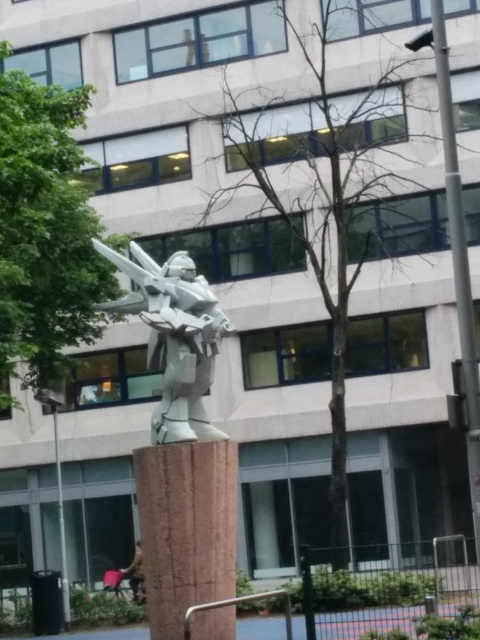
Can you confirm if bare branches at center is taller than brown stone post at center?

No.

Between bare branches at center and brown stone post at center, which one appears on the left side from the viewer's perspective?

brown stone post at center

Who is more forward, (x=301, y=154) or (x=206, y=451)?

Point (x=206, y=451) is more forward.

You are a GUI agent. You are given a task and a screenshot of the screen. Output one action in this format:
    pyautogui.click(x=<x>, y=<y>)
    Task: Click on the bare branches at center
    
    Given the screenshot: What is the action you would take?
    pyautogui.click(x=323, y=200)

What do you see at coordinates (175, 337) in the screenshot? Image resolution: width=480 pixels, height=640 pixels. I see `white glossy statue at center` at bounding box center [175, 337].

Where is `white glossy statue at center`? This screenshot has height=640, width=480. white glossy statue at center is located at coordinates (175, 337).

Identify the location of white glossy statue at center. The width and height of the screenshot is (480, 640). (175, 337).

Who is more distant from viewer, [68,620] or [134,584]?

The point [134,584] is more distant.

Describe the element at coordinates (60, 522) in the screenshot. The width and height of the screenshot is (480, 640). I see `metallic pole at center` at that location.

Who is more distant from viewer, (59, 513) or (137, 598)?

Positioned behind is point (59, 513).

Where is `metallic pole at center`? metallic pole at center is located at coordinates (60, 522).